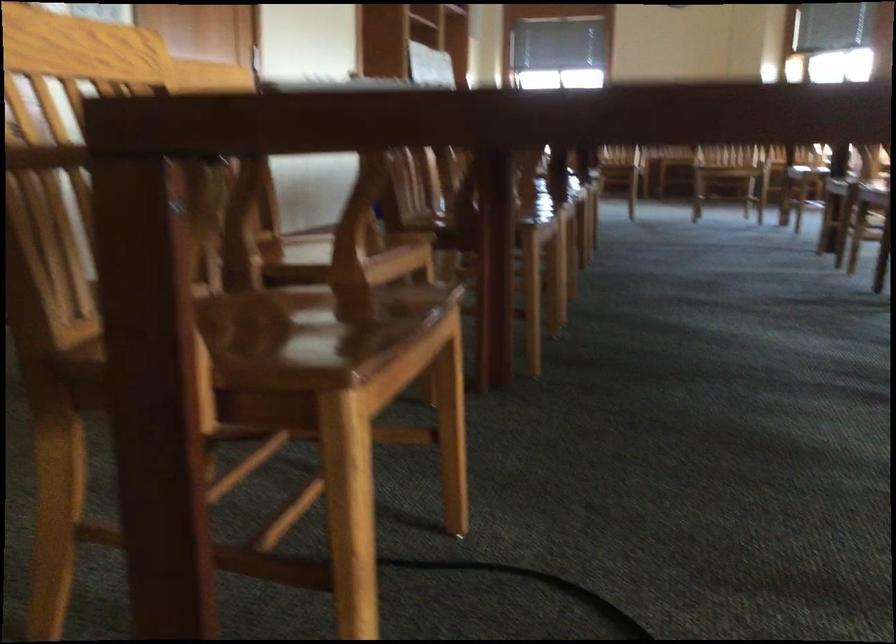
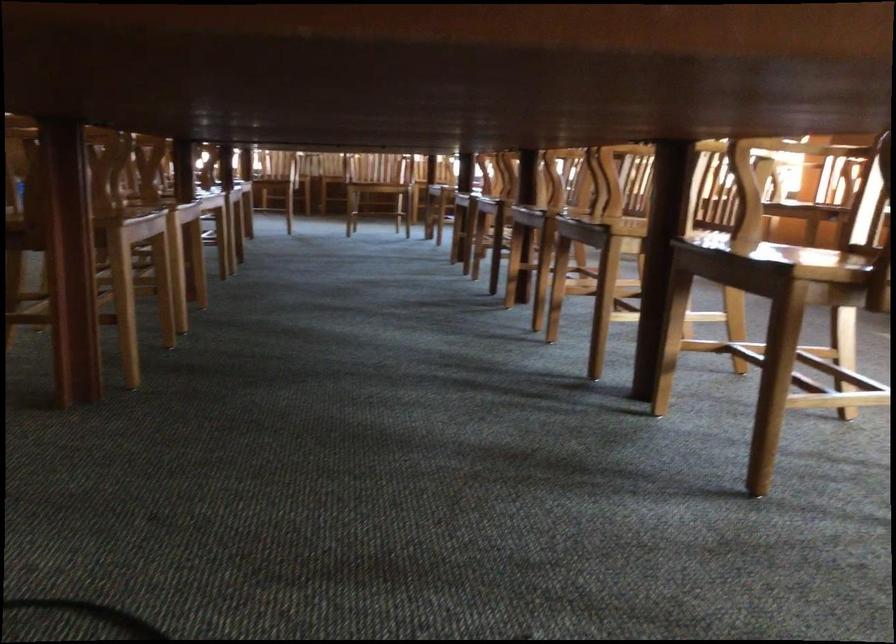
Question: The camera is either moving clockwise (left) or counter-clockwise (right) around the object. The first image is from the beginning of the video and the second image is from the end. Is the camera moving left or right when shooting the video?

Choices:
 (A) Left
 (B) Right

Answer: (A)